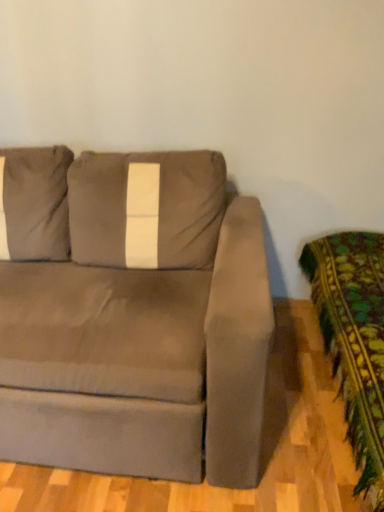
What is the approximate width of suede-like brown couch at center?

The width of suede-like brown couch at center is 1.09 meters.

This screenshot has width=384, height=512. What do you see at coordinates (132, 316) in the screenshot?
I see `suede-like brown couch at center` at bounding box center [132, 316].

At what (x,y) coordinates should I click in order to perform the action: click on suede-like brown couch at center. Please return your answer as a coordinate pair (x, y). This screenshot has height=512, width=384. Looking at the image, I should click on (132, 316).

In order to face suede-like brown couch at center, should I rotate leftwards or rightwards?

Rotate left and turn 14.757 degrees.

What are the coordinates of `suede-like brown couch at center` in the screenshot? It's located at (132, 316).